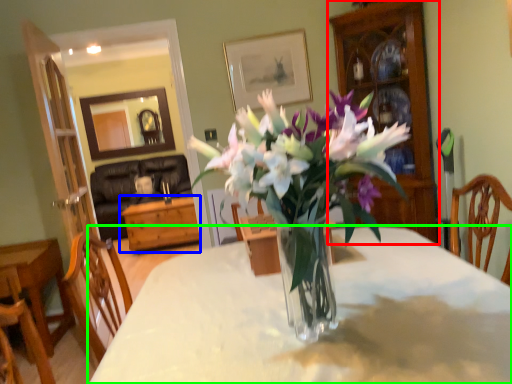
Question: Estimate the real-world distances between objects in this image. Which object is closer to cabinetry (highlighted by a red box), table (highlighted by a blue box) or desk (highlighted by a green box)?

Choices:
 (A) table
 (B) desk

Answer: (B)